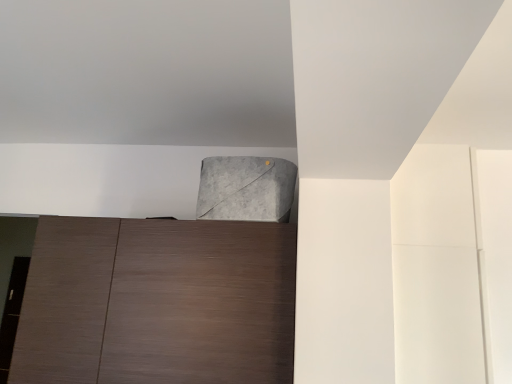
Describe the element at coordinates (246, 189) in the screenshot. I see `gray fabric pouch at upper center` at that location.

Where is `gray fabric pouch at upper center`? The height and width of the screenshot is (384, 512). gray fabric pouch at upper center is located at coordinates (246, 189).

You are a GUI agent. You are given a task and a screenshot of the screen. Output one action in this format:
    pyautogui.click(x=<x>, y=<y>)
    Task: Click on the gray fabric pouch at upper center
    The width and height of the screenshot is (512, 384).
    Given the screenshot: What is the action you would take?
    pyautogui.click(x=246, y=189)